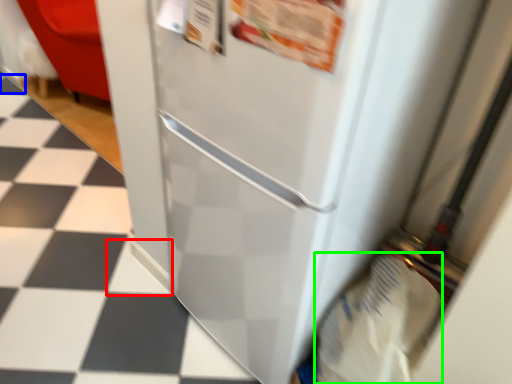
Question: Which is farther away from tile (highlighted by a red box)? tile (highlighted by a blue box) or grocery bag (highlighted by a green box)?

Choices:
 (A) tile
 (B) grocery bag

Answer: (A)